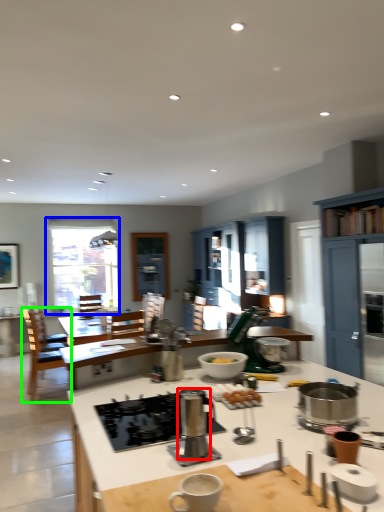
Question: Based on their relative distances, which object is nearer to appliance (highlighted by a red box)? Choose from window (highlighted by a blue box) and chair (highlighted by a green box).

Choices:
 (A) window
 (B) chair

Answer: (B)